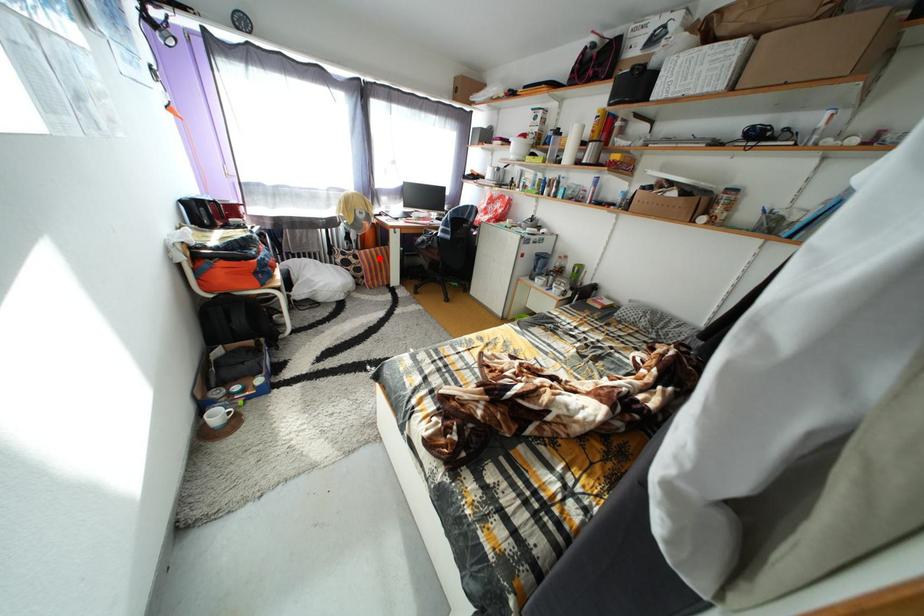
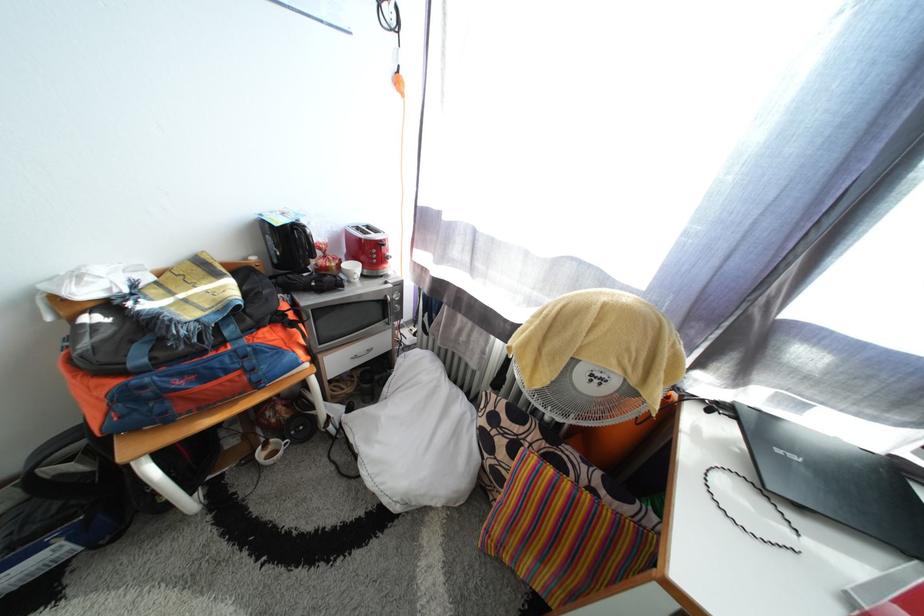
Find the pixel in the second image that matches the highlighted location in the first image.

(563, 493)